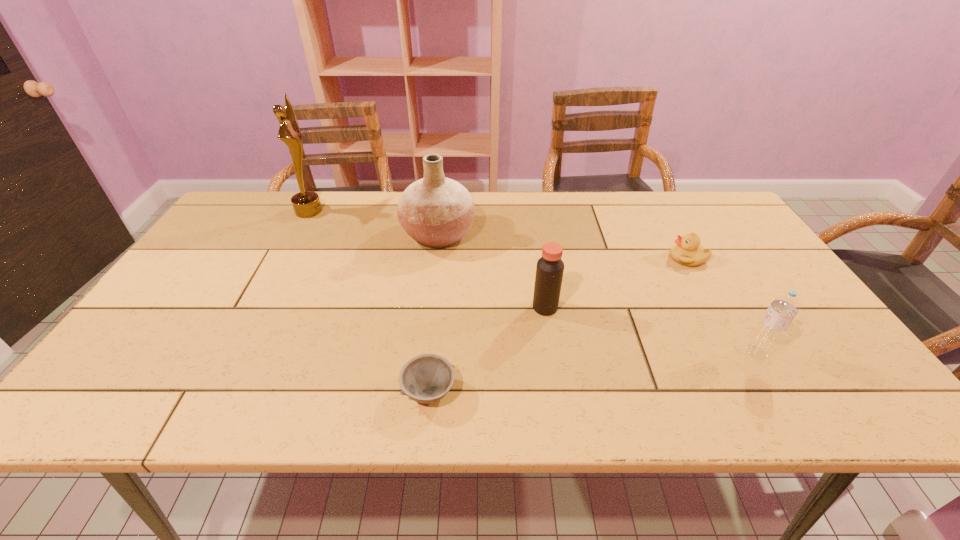
The width and height of the screenshot is (960, 540). What are the coordinates of `unoccupied position between the award and the water bottle` in the screenshot? It's located at pyautogui.click(x=533, y=282).

You are a GUI agent. You are given a task and a screenshot of the screen. Output one action in this format:
    pyautogui.click(x=<x>, y=<y>)
    Task: Click on the vacant region between the fifth shortest object and the duckling
    This screenshot has height=540, width=960.
    Given the screenshot: What is the action you would take?
    pyautogui.click(x=564, y=246)

Locate an element on the screen. This screenshot has width=960, height=540. free area in between the second nearest object and the fifth tallest object is located at coordinates (722, 306).

Locate an element on the screen. vacant area between the duckling and the award is located at coordinates (498, 234).

The width and height of the screenshot is (960, 540). What are the coordinates of `blank region between the bowl and the fifth farthest object` in the screenshot? It's located at (592, 372).

Where is `free space between the pottery and the award`? free space between the pottery and the award is located at coordinates (373, 222).

I want to click on empty location between the second nearest object and the shortest object, so click(592, 372).

The height and width of the screenshot is (540, 960). In order to click on unoccupied area between the fifth tallest object and the pottery in this screenshot , I will do `click(564, 246)`.

Find the location of `the second closest object to the second tallest object`. the second closest object to the second tallest object is located at coordinates (306, 204).

Identify the location of the closest object to the bowl. The width and height of the screenshot is (960, 540). (549, 272).